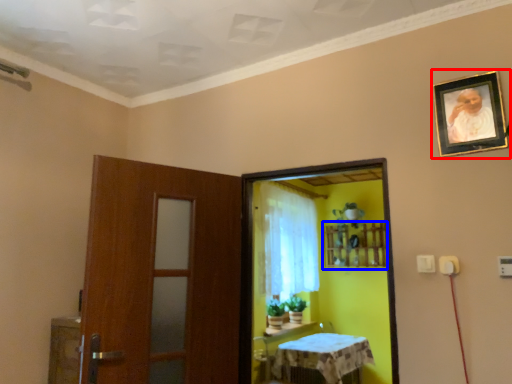
Question: Which of the following is the farthest to the observer, picture frame (highlighted by a red box) or shelf (highlighted by a blue box)?

Choices:
 (A) picture frame
 (B) shelf

Answer: (B)